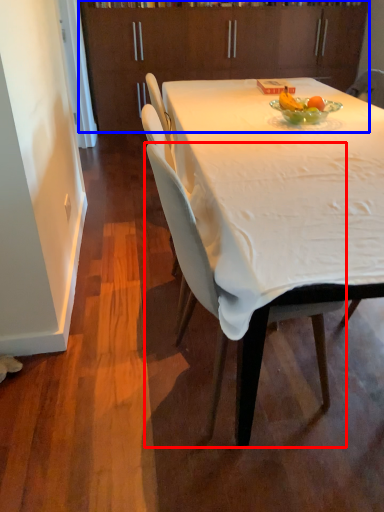
Question: Which of the following is the farthest to the observer, chair (highlighted by a red box) or cabinetry (highlighted by a blue box)?

Choices:
 (A) chair
 (B) cabinetry

Answer: (B)